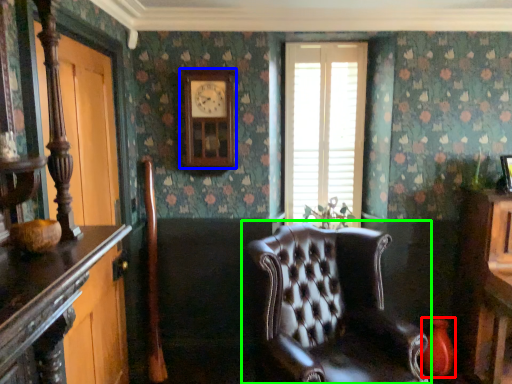
Question: Estimate the real-world distances between objects in this image. Which object is closer to vase (highlighted by a red box), clock (highlighted by a blue box) or chair (highlighted by a green box)?

Choices:
 (A) clock
 (B) chair

Answer: (B)